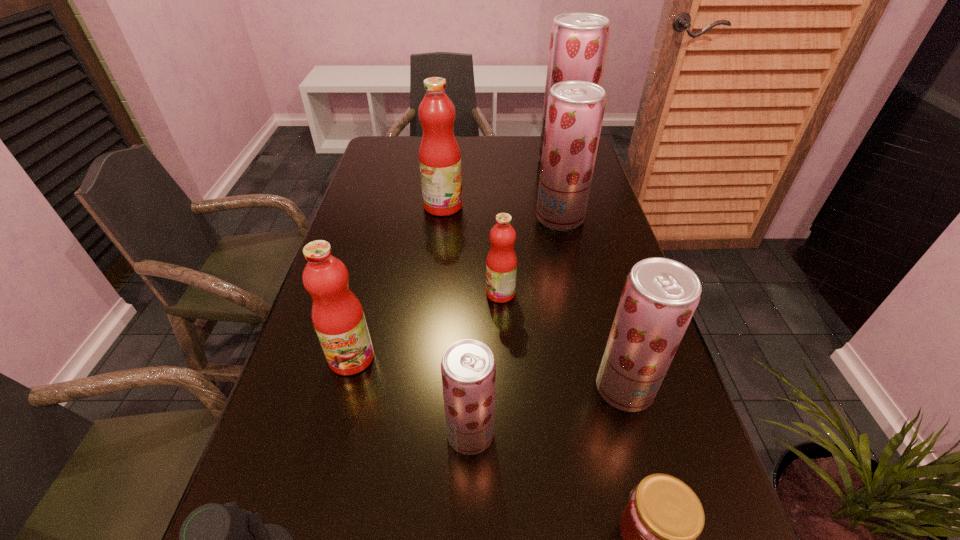
Select which pink fruit juice appears as the closest to the farthest object. Please provide its 2D coordinates. Your answer should be formatted as a tuple, i.e. [(x, y)], where the tuple contains the x and y coordinates of a point satisfying the conditions above.

[(439, 154)]

Where is `vacant region that satisfies the following two spatial constraints: 1. on the front label of the third biggest strawberry fruit juice; 2. on the right side of the rightmost pink fruit juice`? The image size is (960, 540). vacant region that satisfies the following two spatial constraints: 1. on the front label of the third biggest strawberry fruit juice; 2. on the right side of the rightmost pink fruit juice is located at coordinates (505, 388).

The width and height of the screenshot is (960, 540). What are the coordinates of `vacant area that satisfies the following two spatial constraints: 1. on the front label of the third biggest strawberry fruit juice; 2. on the right side of the farthest pink fruit juice` in the screenshot? It's located at (423, 388).

Image resolution: width=960 pixels, height=540 pixels. In order to click on free spot that satisfies the following two spatial constraints: 1. on the back side of the smallest strawberry fruit juice; 2. on the front label of the farthest pink fruit juice in this screenshot , I will do `click(474, 206)`.

At what (x,y) coordinates should I click in order to perform the action: click on vacant area that satisfies the following two spatial constraints: 1. on the front label of the biggest pink fruit juice; 2. on the back side of the third smallest strawberry fruit juice. Please return your answer as a coordinate pair (x, y). The image size is (960, 540). Looking at the image, I should click on (442, 218).